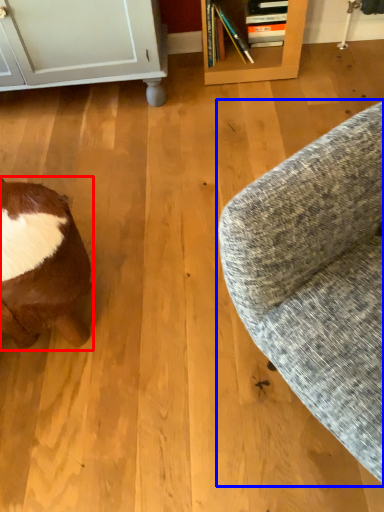
Question: Which point is closer to the camera, animal (highlighted by a red box) or studio couch (highlighted by a blue box)?

Choices:
 (A) animal
 (B) studio couch

Answer: (B)